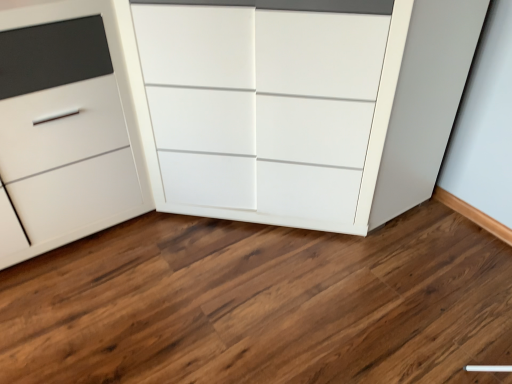
Question: Can you confirm if white glossy cabinet at center, the first chest of drawers when ordered from right to left, is positioned to the right of white matte cabinet at lower left, arranged as the 2th chest of drawers when viewed from the right?

Choices:
 (A) yes
 (B) no

Answer: (A)

Question: Is white glossy cabinet at center, the 2th chest of drawers viewed from the left, turned away from white matte cabinet at lower left, arranged as the 1th chest of drawers when viewed from the left?

Choices:
 (A) no
 (B) yes

Answer: (A)

Question: From the image's perspective, does white glossy cabinet at center, the first chest of drawers when ordered from right to left, appear lower than white matte cabinet at lower left, arranged as the 2th chest of drawers when viewed from the right?

Choices:
 (A) no
 (B) yes

Answer: (A)

Question: Is white glossy cabinet at center, the 2th chest of drawers viewed from the left, thinner than white matte cabinet at lower left, arranged as the 2th chest of drawers when viewed from the right?

Choices:
 (A) no
 (B) yes

Answer: (A)

Question: From the image's perspective, is white glossy cabinet at center, the 2th chest of drawers viewed from the left, over white matte cabinet at lower left, arranged as the 2th chest of drawers when viewed from the right?

Choices:
 (A) yes
 (B) no

Answer: (A)

Question: Is white glossy cabinet at center, the 2th chest of drawers viewed from the left, positioned before white matte cabinet at lower left, arranged as the 2th chest of drawers when viewed from the right?

Choices:
 (A) no
 (B) yes

Answer: (B)

Question: From the image's perspective, is white matte cabinet at lower left, arranged as the 2th chest of drawers when viewed from the right, located above white glossy cabinet at center, the first chest of drawers when ordered from right to left?

Choices:
 (A) no
 (B) yes

Answer: (A)

Question: Is white matte cabinet at lower left, arranged as the 2th chest of drawers when viewed from the right, outside of white glossy cabinet at center, the 2th chest of drawers viewed from the left?

Choices:
 (A) no
 (B) yes

Answer: (B)

Question: Is white matte cabinet at lower left, arranged as the 2th chest of drawers when viewed from the right, at the left side of white glossy cabinet at center, the 2th chest of drawers viewed from the left?

Choices:
 (A) yes
 (B) no

Answer: (A)

Question: Is white matte cabinet at lower left, arranged as the 2th chest of drawers when viewed from the right, facing towards white glossy cabinet at center, the 2th chest of drawers viewed from the left?

Choices:
 (A) no
 (B) yes

Answer: (A)

Question: Is white glossy cabinet at center, the first chest of drawers when ordered from right to left, located within white matte cabinet at lower left, arranged as the 2th chest of drawers when viewed from the right?

Choices:
 (A) yes
 (B) no

Answer: (B)

Question: From a real-world perspective, is white matte cabinet at lower left, arranged as the 1th chest of drawers when viewed from the left, located higher than white glossy cabinet at center, the 2th chest of drawers viewed from the left?

Choices:
 (A) yes
 (B) no

Answer: (B)

Question: From a real-world perspective, is white matte cabinet at lower left, arranged as the 1th chest of drawers when viewed from the left, positioned above or below white glossy cabinet at center, the 2th chest of drawers viewed from the left?

Choices:
 (A) below
 (B) above

Answer: (A)